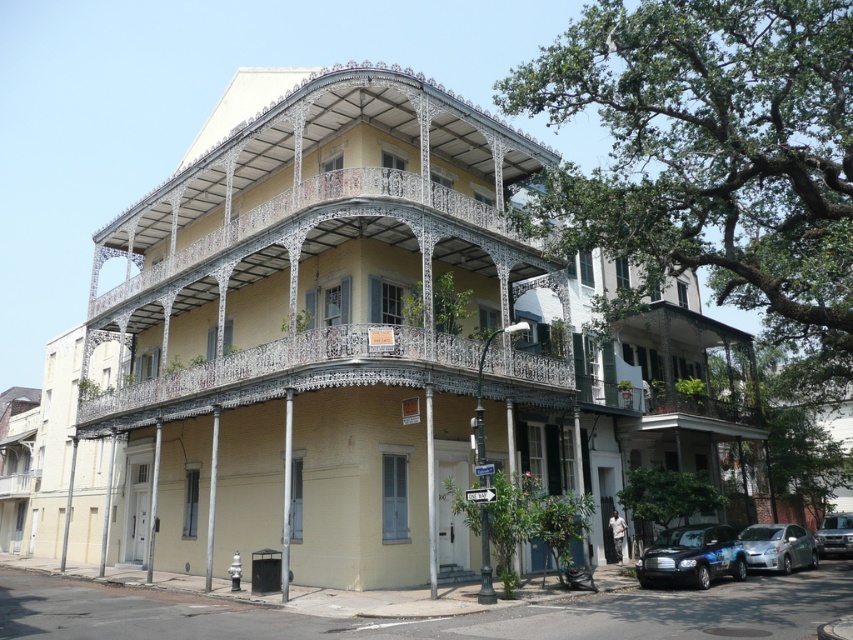
You are a painter standing on the ground floor of the building. You need to paint the white wrought iron balcony at center and the satin silver car at lower right. Which object will require you to use a ladder to reach?

The white wrought iron balcony at center will require a ladder because it is much taller than the satin silver car at lower right.

You are standing on the sidewalk in front of the building and want to take a photo of the point at coordinates point (738, 534). If your camera has a maximum focus range of 20 meters, will you be able to focus on that point?

The distance of point (738, 534) from the camera is 22.74 meters, which exceeds the camera maximum focus range of 20 meters. So you won not be able to focus on that point.

You are a photographer planning to capture the white wrought iron balcony at center and the shiny blue car at lower right in the same frame. Based on their sizes in the image, which object would appear more prominent in the final photograph?

The white wrought iron balcony at center appears more prominent in the photograph because it is larger in size than the shiny blue car at lower right.